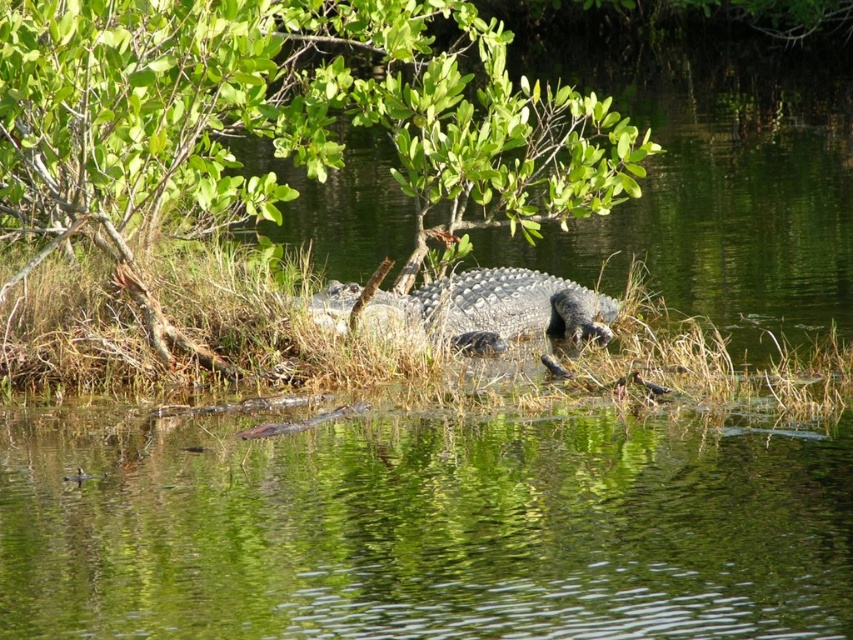
You are standing at the edge of the water in the scene and want to take a photo of both point [605,109] and point [567,330]. Which point will appear larger in your photo?

Point [605,109] is closer to the camera than point [567,330], so it will appear larger in the photo.

You are standing at the edge of the water in the scene. There is a point marked at coordinates (422, 529). What is located at that point?

The point at coordinates (422, 529) indicates green reflective water at center.

From the picture: You are standing at the edge of the water in the scene and want to reach both points marked in the image. Which point, point (699, 628) or point (91, 124), is closer to you?

Point (699, 628) is closer to the viewer than point (91, 124).